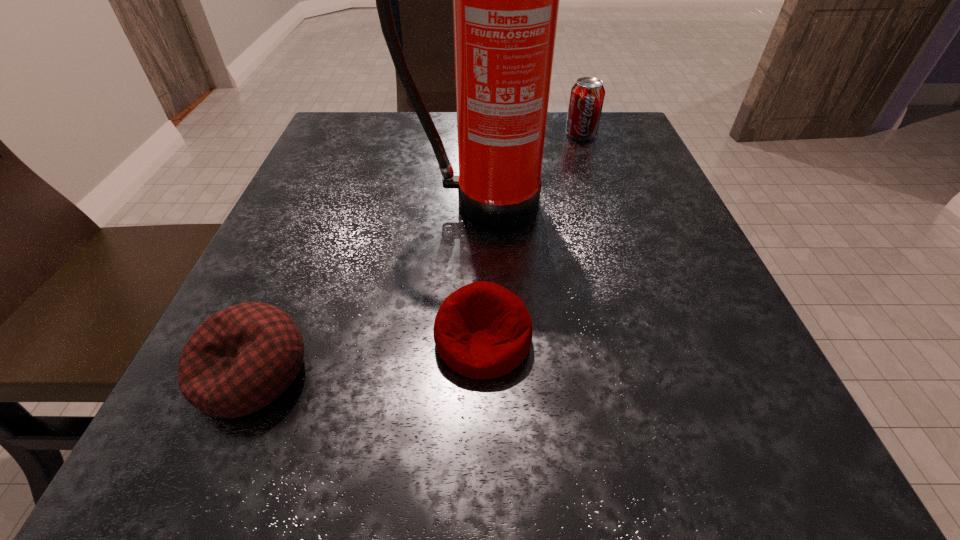
Locate an element on the screen. object that stands as the third closest to the rightmost object is located at coordinates (240, 359).

Find the location of a particular element. The width and height of the screenshot is (960, 540). the second closest object to the rightmost object is located at coordinates coord(482,330).

Locate an element on the screen. vacant region that satisfies the following two spatial constraints: 1. on the back side of the leftmost object; 2. on the right side of the farthest object is located at coordinates (353, 134).